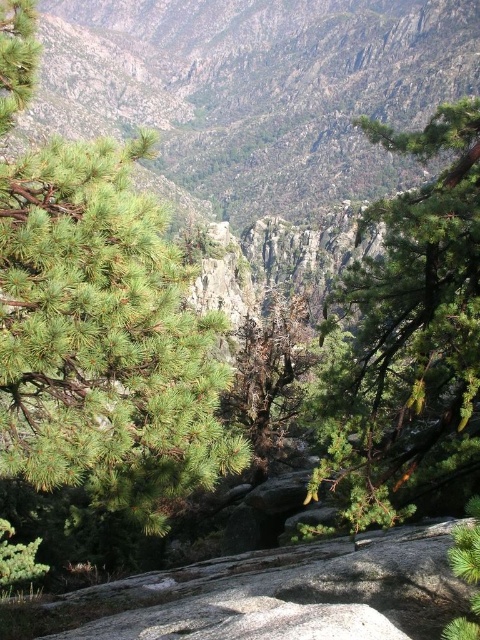
What is the 2D coordinate of the green textured mountain at upper center in the image?

The green textured mountain at upper center is located at the 2D coordinate point of (257, 88).